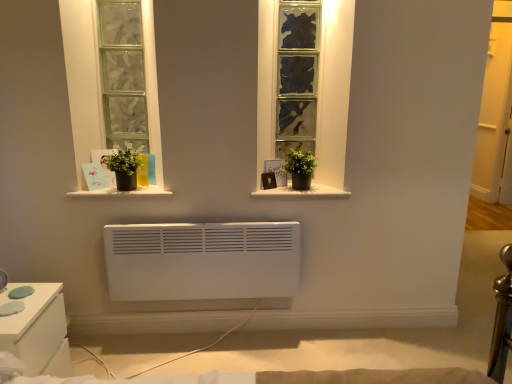
Image resolution: width=512 pixels, height=384 pixels. Describe the element at coordinates (297, 75) in the screenshot. I see `textured glass window at center` at that location.

Describe the element at coordinates (122, 192) in the screenshot. I see `matte black pot at center, which is counted as the 1th window sill, starting from the left` at that location.

In order to click on green matte plant pot at center, which is the first houseplant from right to left in this screenshot , I will do `click(300, 168)`.

The image size is (512, 384). I want to click on white matte window sill at center, which is counted as the 1th window sill, starting from the right, so click(302, 192).

The height and width of the screenshot is (384, 512). What do you see at coordinates (126, 168) in the screenshot? I see `green matte plant pot at left, the first houseplant viewed from the left` at bounding box center [126, 168].

Identify the location of white glossy nightstand at lower left. (38, 330).

Is matte black pot at center, acting as the 2th window sill starting from the right, oriented towards white glossy nightstand at lower left?

No, matte black pot at center, acting as the 2th window sill starting from the right, is not aimed at white glossy nightstand at lower left.

From a real-world perspective, between matte black pot at center, acting as the 2th window sill starting from the right, and white glossy nightstand at lower left, who is vertically higher?

matte black pot at center, acting as the 2th window sill starting from the right.

Consider the image. Is matte black pot at center, acting as the 2th window sill starting from the right, taller or shorter than white glossy nightstand at lower left?

Clearly, matte black pot at center, acting as the 2th window sill starting from the right, is shorter compared to white glossy nightstand at lower left.

Is matte black pot at center, which is counted as the 1th window sill, starting from the left, not near white glossy nightstand at lower left?

They are positioned close to each other.

Is white glossy nightstand at lower left in contact with textured glass window at center?

No, white glossy nightstand at lower left is not beside textured glass window at center.

From the image's perspective, is white glossy nightstand at lower left positioned above or below textured glass window at center?

Based on their image positions, white glossy nightstand at lower left is located beneath textured glass window at center.

Does white glossy nightstand at lower left have a larger size compared to textured glass window at center?

Indeed, white glossy nightstand at lower left has a larger size compared to textured glass window at center.

From a real-world perspective, is white glossy nightstand at lower left physically below textured glass window at center?

Correct, in the physical world, white glossy nightstand at lower left is lower than textured glass window at center.

Is white matte window sill at center, which is counted as the 1th window sill, starting from the right, positioned in front of green matte plant pot at center, which is the first houseplant from right to left?

No, white matte window sill at center, which is counted as the 1th window sill, starting from the right, is further to the viewer.

Between white matte window sill at center, placed as the 2th window sill when sorted from left to right, and green matte plant pot at center, which is the first houseplant from right to left, which one has smaller width?

Thinner between the two is green matte plant pot at center, which is the first houseplant from right to left.

Between white matte window sill at center, which is counted as the 1th window sill, starting from the right, and green matte plant pot at center, placed as the second houseplant when sorted from left to right, which one has larger size?

Bigger between the two is green matte plant pot at center, placed as the second houseplant when sorted from left to right.

Is white matte window sill at center, placed as the 2th window sill when sorted from left to right, beside green matte plant pot at center, which is the first houseplant from right to left?

white matte window sill at center, placed as the 2th window sill when sorted from left to right, and green matte plant pot at center, which is the first houseplant from right to left, are not in contact.

What are the coordinates of `furniture directly beneath the white matte window sill at center, which is counted as the 1th window sill, starting from the right (from a real-world perspective)` in the screenshot? It's located at (38, 330).

Looking at this image, from a real-world perspective, is white matte window sill at center, which is counted as the 1th window sill, starting from the right, located higher than white glossy nightstand at lower left?

Indeed, from a real-world perspective, white matte window sill at center, which is counted as the 1th window sill, starting from the right, stands above white glossy nightstand at lower left.

Does point (258, 196) lie in front of point (34, 288)?

That is False.

From the image's perspective, which object appears higher, white matte window sill at center, placed as the 2th window sill when sorted from left to right, or white glossy nightstand at lower left?

white matte window sill at center, placed as the 2th window sill when sorted from left to right, is shown above in the image.

Who is shorter, textured glass window at center or white matte window sill at center, placed as the 2th window sill when sorted from left to right?

Standing shorter between the two is white matte window sill at center, placed as the 2th window sill when sorted from left to right.

Is textured glass window at center not inside white matte window sill at center, placed as the 2th window sill when sorted from left to right?

Yes, textured glass window at center is outside of white matte window sill at center, placed as the 2th window sill when sorted from left to right.

Is textured glass window at center with white matte window sill at center, placed as the 2th window sill when sorted from left to right?

There is a gap between textured glass window at center and white matte window sill at center, placed as the 2th window sill when sorted from left to right.

Which of these two, textured glass window at center or green matte plant pot at left, the first houseplant viewed from the left, is thinner?

green matte plant pot at left, the first houseplant viewed from the left, is thinner.

The height and width of the screenshot is (384, 512). Identify the location of the 1st houseplant below the textured glass window at center (from a real-world perspective). (x=126, y=168).

Is textured glass window at center taller than green matte plant pot at left, the first houseplant viewed from the left?

Yes, textured glass window at center is taller than green matte plant pot at left, the first houseplant viewed from the left.

Does textured glass window at center turn towards green matte plant pot at left, the first houseplant viewed from the left?

No, textured glass window at center is not facing towards green matte plant pot at left, the first houseplant viewed from the left.

Is the depth of green matte plant pot at center, which is the first houseplant from right to left, less than that of matte black pot at center, acting as the 2th window sill starting from the right?

No, green matte plant pot at center, which is the first houseplant from right to left, is behind matte black pot at center, acting as the 2th window sill starting from the right.

You are a GUI agent. You are given a task and a screenshot of the screen. Output one action in this format:
    pyautogui.click(x=<x>, y=<y>)
    Task: Click on the window sill located on the left of green matte plant pot at center, placed as the second houseplant when sorted from left to right
    
    Given the screenshot: What is the action you would take?
    pyautogui.click(x=122, y=192)

Based on the photo, does green matte plant pot at center, which is the first houseplant from right to left, have a lesser width compared to matte black pot at center, acting as the 2th window sill starting from the right?

Correct, the width of green matte plant pot at center, which is the first houseplant from right to left, is less than that of matte black pot at center, acting as the 2th window sill starting from the right.

Locate an element on the screen. The width and height of the screenshot is (512, 384). the 1st window sill behind the white glossy nightstand at lower left, starting your count from the anchor is located at coordinates (122, 192).

You are a GUI agent. You are given a task and a screenshot of the screen. Output one action in this format:
    pyautogui.click(x=<x>, y=<y>)
    Task: Click on the window on the right of white glossy nightstand at lower left
    The height and width of the screenshot is (384, 512).
    Given the screenshot: What is the action you would take?
    pyautogui.click(x=297, y=75)

Based on their spatial positions, is white glossy nightstand at lower left or white matte window sill at center, which is counted as the 1th window sill, starting from the right, closer to green matte plant pot at center, placed as the second houseplant when sorted from left to right?

white matte window sill at center, which is counted as the 1th window sill, starting from the right, is closer to green matte plant pot at center, placed as the second houseplant when sorted from left to right.

From the image, which object appears to be farther from matte black pot at center, which is counted as the 1th window sill, starting from the left, green matte plant pot at left, the first houseplant viewed from the left, or green matte plant pot at center, which is the first houseplant from right to left?

green matte plant pot at center, which is the first houseplant from right to left, is positioned further to the anchor matte black pot at center, which is counted as the 1th window sill, starting from the left.

Which object lies further to the anchor point green matte plant pot at left, which appears as the second houseplant when viewed from the right, white matte window sill at center, which is counted as the 1th window sill, starting from the right, or textured glass window at center?

textured glass window at center.

Which object lies nearer to the anchor point white glossy nightstand at lower left, matte black pot at center, acting as the 2th window sill starting from the right, or green matte plant pot at left, the first houseplant viewed from the left?

matte black pot at center, acting as the 2th window sill starting from the right.

From the image, which object appears to be farther from matte black pot at center, which is counted as the 1th window sill, starting from the left, white matte window sill at center, placed as the 2th window sill when sorted from left to right, or textured glass window at center?

textured glass window at center is further to matte black pot at center, which is counted as the 1th window sill, starting from the left.

From the image, which object appears to be farther from white glossy nightstand at lower left, textured glass window at center or green matte plant pot at center, placed as the second houseplant when sorted from left to right?

textured glass window at center is further to white glossy nightstand at lower left.

Based on their spatial positions, is green matte plant pot at center, placed as the second houseplant when sorted from left to right, or green matte plant pot at left, which appears as the second houseplant when viewed from the right, closer to textured glass window at center?

Based on the image, green matte plant pot at center, placed as the second houseplant when sorted from left to right, appears to be nearer to textured glass window at center.

Based on their spatial positions, is white matte window sill at center, placed as the 2th window sill when sorted from left to right, or matte black pot at center, which is counted as the 1th window sill, starting from the left, further from green matte plant pot at left, the first houseplant viewed from the left?

white matte window sill at center, placed as the 2th window sill when sorted from left to right.

This screenshot has height=384, width=512. Identify the location of window located between matte black pot at center, acting as the 2th window sill starting from the right, and white matte window sill at center, which is counted as the 1th window sill, starting from the right, in the left-right direction. (297, 75).

Locate an element on the screen. The image size is (512, 384). houseplant located between white glossy nightstand at lower left and green matte plant pot at center, placed as the second houseplant when sorted from left to right, in the left-right direction is located at coordinates (126, 168).

The height and width of the screenshot is (384, 512). I want to click on window between matte black pot at center, which is counted as the 1th window sill, starting from the left, and green matte plant pot at center, which is the first houseplant from right to left, so click(x=297, y=75).

Where is `window between green matte plant pot at left, which appears as the second houseplant when viewed from the right, and white matte window sill at center, placed as the 2th window sill when sorted from left to right`? window between green matte plant pot at left, which appears as the second houseplant when viewed from the right, and white matte window sill at center, placed as the 2th window sill when sorted from left to right is located at coordinates (297, 75).